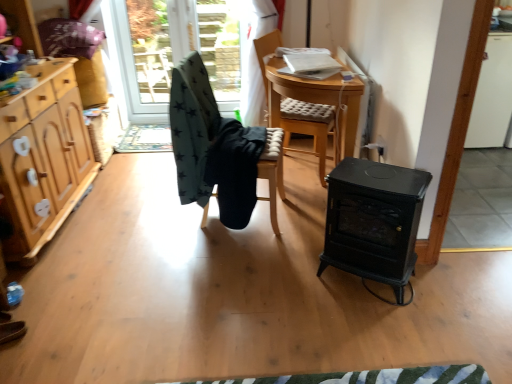
This screenshot has width=512, height=384. What are the coordinates of `unoccupied area in front of black cast iron stove at center` in the screenshot? It's located at click(387, 326).